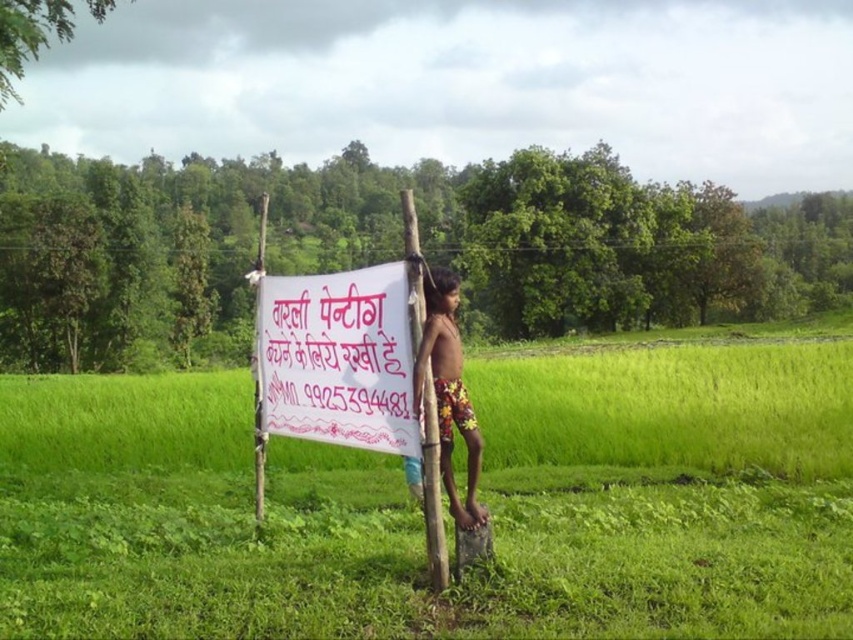
Question: Which object is farther from the camera taking this photo?

Choices:
 (A) smooth bamboo pole at center
 (B) green grass at center
 (C) floral shorts at center
 (D) white paper banner at center

Answer: (A)

Question: Is white paper banner at center bigger than smooth bamboo pole at center?

Choices:
 (A) no
 (B) yes

Answer: (B)

Question: From the image, what is the correct spatial relationship of white paper banner at center in relation to floral shorts at center?

Choices:
 (A) below
 (B) above

Answer: (B)

Question: Among these objects, which one is nearest to the camera?

Choices:
 (A) green grass at center
 (B) smooth bamboo pole at center
 (C) white paper banner at center

Answer: (A)

Question: Does floral shorts at center have a lesser width compared to smooth bamboo pole at center?

Choices:
 (A) yes
 (B) no

Answer: (B)

Question: Which object is closer to the camera taking this photo?

Choices:
 (A) white paper banner at center
 (B) floral shorts at center
 (C) smooth bamboo pole at center
 (D) green grass at center

Answer: (D)